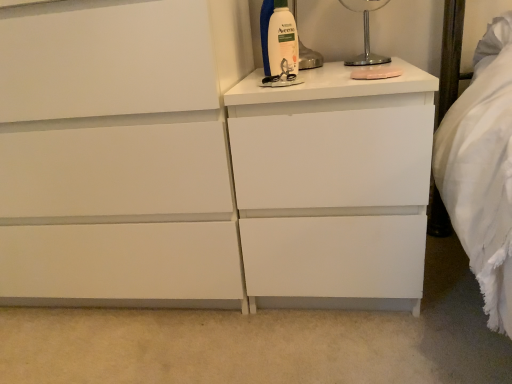
This screenshot has height=384, width=512. What do you see at coordinates (282, 40) in the screenshot?
I see `white plastic bottle at upper right` at bounding box center [282, 40].

Measure the distance between point (291, 16) and camera.

The distance of point (291, 16) from camera is 38.82 inches.

Measure the distance between point (391, 229) and camera.

35.28 inches.

Identify the location of metallic silver lamp at upper right. The image size is (512, 384). (365, 32).

Between white matte chest of drawers at center and white plastic bottle at upper right, which one has larger width?

white matte chest of drawers at center.

From the picture: Between white matte chest of drawers at center and white plastic bottle at upper right, which one has less height?

Standing shorter between the two is white plastic bottle at upper right.

Is white plastic bottle at upper right inside white matte chest of drawers at center?

Definitely not — white plastic bottle at upper right is not inside white matte chest of drawers at center.

Which is nearer, (54, 108) or (268, 28)?

Point (54, 108) is closer to the camera than point (268, 28).

From the image's perspective, which object appears higher, white matte chest of drawers at center or white matte nightstand at center?

white matte chest of drawers at center appears higher in the image.

Looking at this image, which of these two, white matte chest of drawers at center or white matte nightstand at center, is wider?

white matte chest of drawers at center is wider.

How different are the orientations of white matte chest of drawers at center and white matte nightstand at center in degrees?

The facing directions of white matte chest of drawers at center and white matte nightstand at center are 7.72e-05 degrees apart.

Who is bigger, white matte chest of drawers at center or white matte nightstand at center?

Bigger between the two is white matte chest of drawers at center.

Is metallic silver lamp at upper right at the left side of white plastic bottle at upper right?

In fact, metallic silver lamp at upper right is to the right of white plastic bottle at upper right.

From a real-world perspective, is metallic silver lamp at upper right positioned over white plastic bottle at upper right based on gravity?

Correct, in the physical world, metallic silver lamp at upper right is higher than white plastic bottle at upper right.

Is metallic silver lamp at upper right wider or thinner than white plastic bottle at upper right?

Clearly, metallic silver lamp at upper right has more width compared to white plastic bottle at upper right.

Is point (367, 34) less distant than point (295, 25)?

No, it is not.

Based on the photo, which object is positioned more to the right, white matte nightstand at center or metallic silver lamp at upper right?

metallic silver lamp at upper right.

How different are the orientations of white matte nightstand at center and metallic silver lamp at upper right in degrees?

The angle between the facing direction of white matte nightstand at center and the facing direction of metallic silver lamp at upper right is 1.23 degrees.

Is white matte nightstand at center bigger than metallic silver lamp at upper right?

Indeed, white matte nightstand at center has a larger size compared to metallic silver lamp at upper right.

Would you consider white matte nightstand at center to be distant from metallic silver lamp at upper right?

They are positioned close to each other.

This screenshot has width=512, height=384. Identify the location of nightstand in front of the white plastic bottle at upper right. (333, 184).

Can you tell me how much white matte nightstand at center and white plastic bottle at upper right differ in facing direction?

The facing directions of white matte nightstand at center and white plastic bottle at upper right are 35.4 degrees apart.

Between white matte nightstand at center and white plastic bottle at upper right, which one has less height?

white plastic bottle at upper right is shorter.

From a real-world perspective, is white matte nightstand at center located higher than white plastic bottle at upper right?

No, from a real-world perspective, white matte nightstand at center is not on top of white plastic bottle at upper right.

Between white matte chest of drawers at center and metallic silver lamp at upper right, which one has smaller size?

With smaller size is metallic silver lamp at upper right.

Measure the distance from white matte chest of drawers at center to metallic silver lamp at upper right.

The distance of white matte chest of drawers at center from metallic silver lamp at upper right is 57.92 centimeters.

In the scene shown: Would you consider white matte chest of drawers at center to be distant from metallic silver lamp at upper right?

white matte chest of drawers at center is near metallic silver lamp at upper right, not far away.

From a real-world perspective, is white matte chest of drawers at center physically located above or below metallic silver lamp at upper right?

From a real-world perspective, white matte chest of drawers at center is physically below metallic silver lamp at upper right.

Would you say metallic silver lamp at upper right is inside or outside white matte chest of drawers at center?

metallic silver lamp at upper right is outside white matte chest of drawers at center.

In terms of height, does metallic silver lamp at upper right look taller or shorter compared to white matte chest of drawers at center?

Considering their sizes, metallic silver lamp at upper right has less height than white matte chest of drawers at center.

Based on the photo, how many degrees apart are the facing directions of metallic silver lamp at upper right and white matte chest of drawers at center?

The facing directions of metallic silver lamp at upper right and white matte chest of drawers at center are 1.23 degrees apart.

Between metallic silver lamp at upper right and white matte chest of drawers at center, which one has smaller width?

Thinner between the two is metallic silver lamp at upper right.

You are a GUI agent. You are given a task and a screenshot of the screen. Output one action in this format:
    pyautogui.click(x=<x>, y=<y>)
    Task: Click on the chest of drawers below the white plastic bottle at upper right (from the image's perspective)
    Image resolution: width=512 pixels, height=384 pixels.
    Given the screenshot: What is the action you would take?
    pyautogui.click(x=199, y=164)

At what (x,y) coordinates should I click in order to perform the action: click on the chest of drawers that appears in front of the white matte nightstand at center. Please return your answer as a coordinate pair (x, y). Looking at the image, I should click on (199, 164).

Looking at the image, which one is located further to metallic silver lamp at upper right, white matte nightstand at center or white matte chest of drawers at center?

white matte chest of drawers at center is positioned further to the anchor metallic silver lamp at upper right.

Which object lies further to the anchor point white matte chest of drawers at center, white matte nightstand at center or metallic silver lamp at upper right?

metallic silver lamp at upper right is positioned further to the anchor white matte chest of drawers at center.

When comparing their distances from white matte nightstand at center, does metallic silver lamp at upper right or white plastic bottle at upper right seem closer?

The object closer to white matte nightstand at center is white plastic bottle at upper right.

Based on the photo, considering their positions, is white matte chest of drawers at center positioned closer to white matte nightstand at center than white plastic bottle at upper right?

Based on the image, white matte chest of drawers at center appears to be nearer to white matte nightstand at center.

Which object lies nearer to the anchor point white plastic bottle at upper right, metallic silver lamp at upper right or white matte chest of drawers at center?

The object closer to white plastic bottle at upper right is metallic silver lamp at upper right.

Which object lies nearer to the anchor point white plastic bottle at upper right, white matte nightstand at center or white matte chest of drawers at center?

white matte nightstand at center.

Based on their spatial positions, is white matte nightstand at center or white plastic bottle at upper right closer to white matte chest of drawers at center?

white matte nightstand at center lies closer to white matte chest of drawers at center than the other object.

When comparing their distances from white matte nightstand at center, does white plastic bottle at upper right or metallic silver lamp at upper right seem further?

metallic silver lamp at upper right is further to white matte nightstand at center.

Image resolution: width=512 pixels, height=384 pixels. What are the coordinates of `nightstand situated between white matte chest of drawers at center and metallic silver lamp at upper right from left to right` in the screenshot? It's located at (333, 184).

This screenshot has height=384, width=512. I want to click on cleaning product between white matte chest of drawers at center and white matte nightstand at center in the horizontal direction, so click(282, 40).

Identify the location of cleaning product between metallic silver lamp at upper right and white matte nightstand at center in the up-down direction. (282, 40).

This screenshot has height=384, width=512. What are the coordinates of `cleaning product between white matte chest of drawers at center and metallic silver lamp at upper right in the horizontal direction` in the screenshot? It's located at pyautogui.click(x=282, y=40).